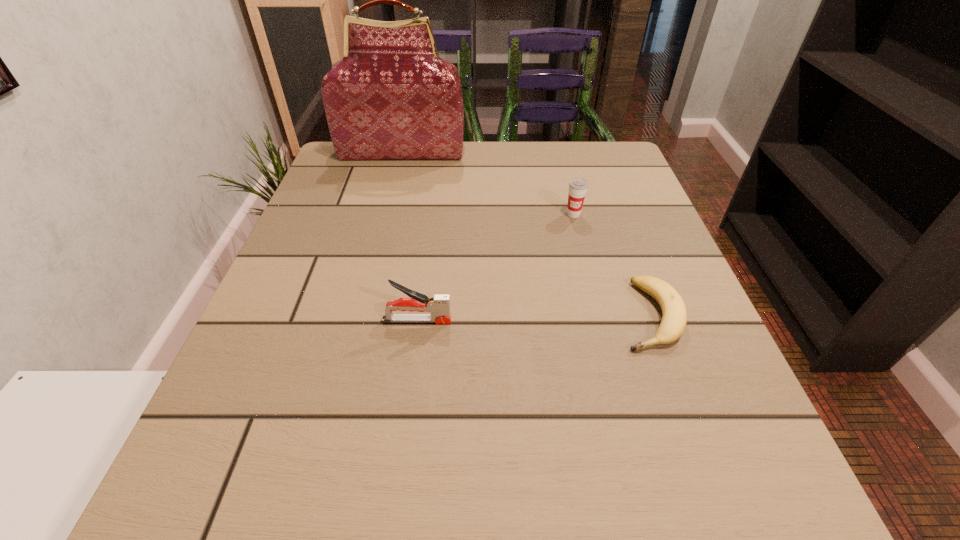
This screenshot has width=960, height=540. In the image, there is a desktop. Identify the location of vacant space at the far left corner. (359, 171).

Locate an element on the screen. Image resolution: width=960 pixels, height=540 pixels. free space between the cup and the banana is located at coordinates point(612,265).

At what (x,y) coordinates should I click in order to perform the action: click on free spot between the tallest object and the stapler. Please return your answer as a coordinate pair (x, y). This screenshot has width=960, height=540. Looking at the image, I should click on (x=410, y=236).

Identify the location of free space between the tallest object and the shortest object. (526, 233).

You are a GUI agent. You are given a task and a screenshot of the screen. Output one action in this format:
    pyautogui.click(x=<x>, y=<y>)
    Task: Click on the vacant space that's between the rightmost object and the stapler
    The width and height of the screenshot is (960, 540).
    Given the screenshot: What is the action you would take?
    pyautogui.click(x=534, y=318)

The height and width of the screenshot is (540, 960). Identify the location of empty space between the shortest object and the stapler. (534, 318).

Where is `unoccupied area between the stapler and the handbag`? Image resolution: width=960 pixels, height=540 pixels. unoccupied area between the stapler and the handbag is located at coordinates (410, 236).

Identify the location of vacant area that lies between the second farthest object and the stapler. (495, 267).

Where is `free spot between the stapler and the shortest object`? Image resolution: width=960 pixels, height=540 pixels. free spot between the stapler and the shortest object is located at coordinates (534, 318).

Where is `free space between the stapler and the rightmost object`? Image resolution: width=960 pixels, height=540 pixels. free space between the stapler and the rightmost object is located at coordinates (534, 318).